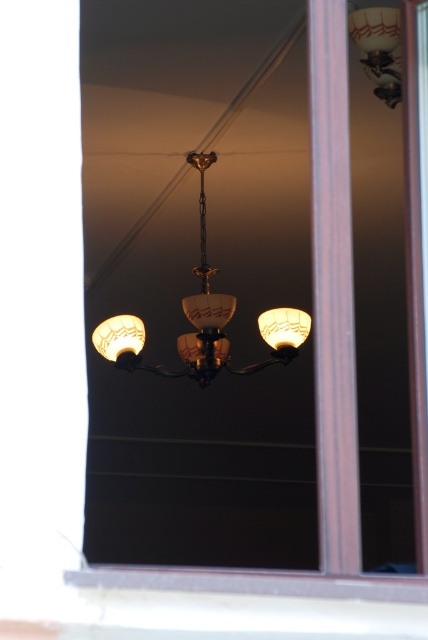
Between matte glass chandelier at center and translucent glass lampshade at right, which one appears on the left side from the viewer's perspective?

matte glass chandelier at center is more to the left.

Who is positioned more to the right, matte glass chandelier at center or translucent glass lampshade at right?

Positioned to the right is translucent glass lampshade at right.

Find the location of a particular element. Image resolution: width=428 pixels, height=640 pixels. matte glass chandelier at center is located at coordinates (187, 320).

Can you confirm if brown wood pillar at right is wider than matte glass lampshade at upper right?

In fact, brown wood pillar at right might be narrower than matte glass lampshade at upper right.

Describe the element at coordinates (332, 291) in the screenshot. I see `brown wood pillar at right` at that location.

Which is behind, point (326, 45) or point (383, 100)?

Positioned behind is point (383, 100).

This screenshot has height=640, width=428. I want to click on brown wood pillar at right, so click(x=332, y=291).

From the picture: Does brown wood pillar at right lie in front of matte glass chandelier at center?

Yes, it is in front of matte glass chandelier at center.

Can you confirm if brown wood pillar at right is wider than matte glass chandelier at center?

No, brown wood pillar at right is not wider than matte glass chandelier at center.

Identify the location of brown wood pillar at right. The width and height of the screenshot is (428, 640). (332, 291).

You are a GUI agent. You are given a task and a screenshot of the screen. Output one action in this format:
    pyautogui.click(x=<x>, y=<y>)
    Task: Click on the brown wood pillar at right
    
    Given the screenshot: What is the action you would take?
    pyautogui.click(x=332, y=291)